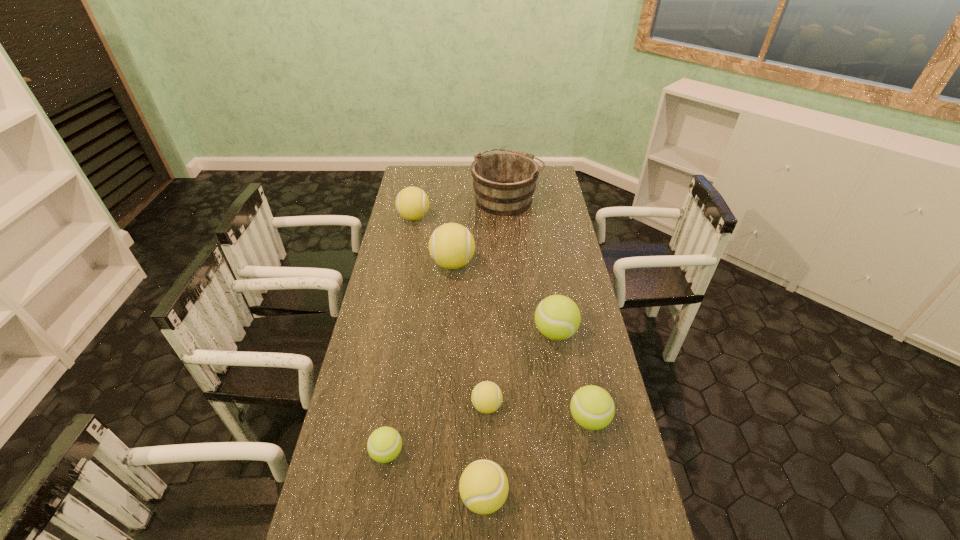
At what (x,y) coordinates should I click in order to perform the action: click on the smallest yellow tennis ball. Please return your answer as a coordinate pair (x, y). The image size is (960, 540). Looking at the image, I should click on (486, 397).

Locate an element on the screen. the smallest green tennis ball is located at coordinates (384, 444).

At what (x,y) coordinates should I click in order to perform the action: click on vacant region located on the left of the wine bucket. Please return your answer as a coordinate pair (x, y). The width and height of the screenshot is (960, 540). Looking at the image, I should click on (430, 198).

Identify the location of blank space located 0.060m on the back of the tallest tennis ball. Image resolution: width=960 pixels, height=540 pixels. (454, 241).

At what (x,y) coordinates should I click in order to perform the action: click on vacant position located 0.090m on the left of the third farthest tennis ball. Please return your answer as a coordinate pair (x, y). The height and width of the screenshot is (540, 960). Looking at the image, I should click on (507, 333).

Locate an element on the screen. This screenshot has height=540, width=960. vacant point located 0.090m on the front of the leftmost yellow tennis ball is located at coordinates (410, 240).

Identify the location of free region located on the right of the nearest yellow tennis ball. click(x=567, y=497).

This screenshot has width=960, height=540. Identify the location of free space located on the left of the second smallest green tennis ball. (529, 419).

The width and height of the screenshot is (960, 540). I want to click on vacant area situated 0.380m on the back of the smallest yellow tennis ball, so click(x=486, y=303).

What are the coordinates of `vacant space positioned 0.120m on the right of the smallest green tennis ball` in the screenshot? It's located at (448, 453).